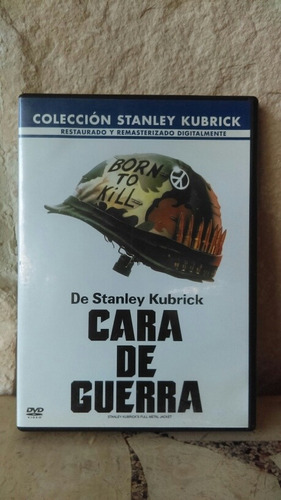
Image resolution: width=281 pixels, height=500 pixels. Identify the location of dvd case. (52, 246).